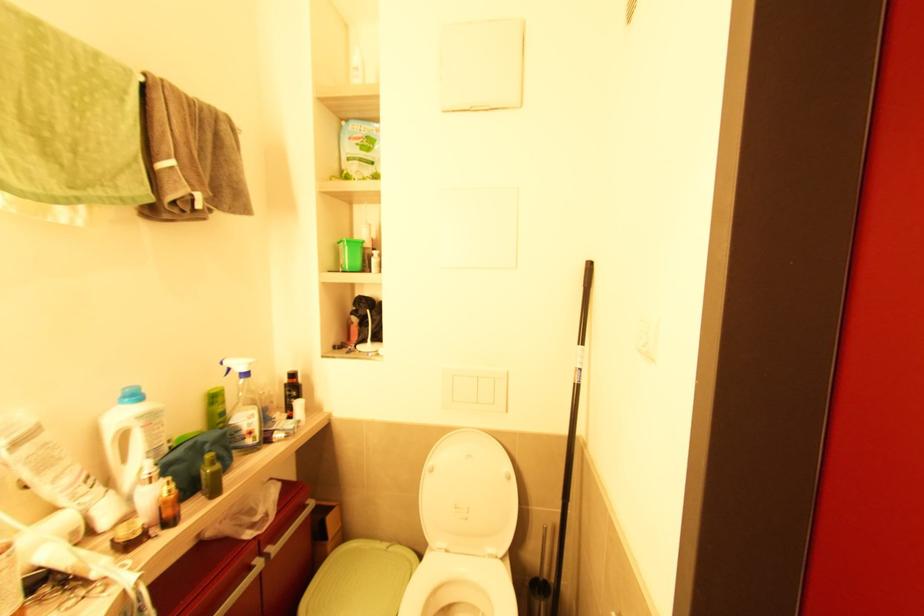
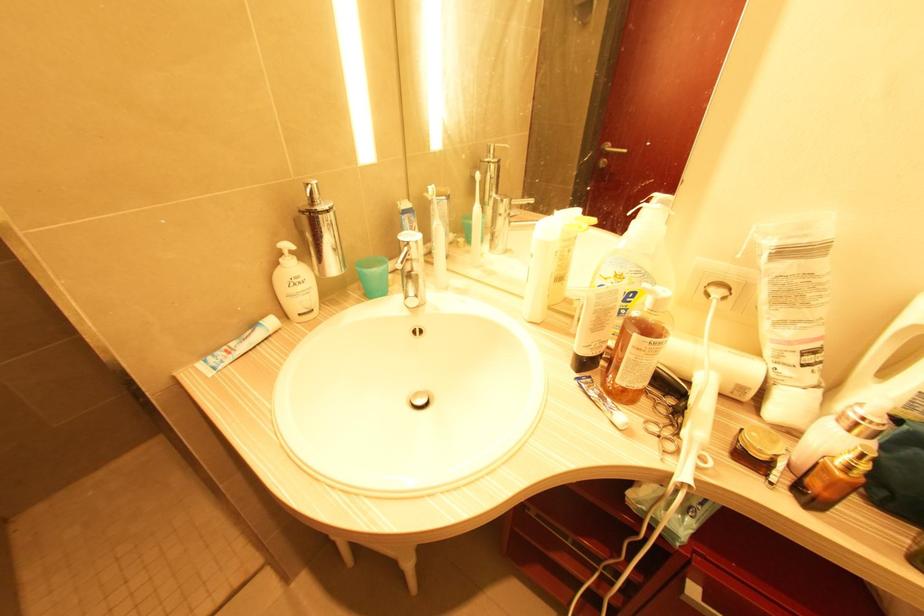
In the second image, find the point that corresponds to pixel 76 533 in the first image.

(743, 390)